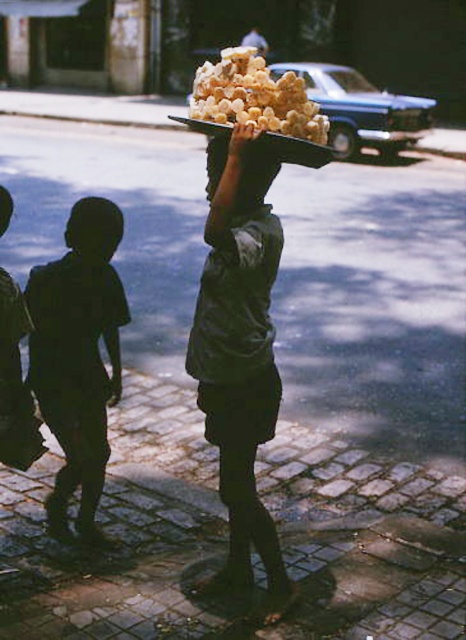
Which is above, dark green fabric shirt at center or silhouette skin child at left?

dark green fabric shirt at center

Does dark green fabric shirt at center have a smaller size compared to silhouette skin child at left?

No.

Between point (253, 208) and point (95, 300), which one is positioned behind?

The point (95, 300) is behind.

In order to click on dark green fabric shirt at center in this screenshot , I will do `click(239, 346)`.

Does silhouette skin child at left appear over black matte head at center?

No.

Is silhouette skin child at left positioned behind black matte head at center?

No, it is in front of black matte head at center.

Which is in front, point (94, 472) or point (88, 220)?

Point (88, 220)

This screenshot has width=466, height=640. I want to click on silhouette skin child at left, so click(77, 355).

Where is `golden crispy pastry at center`? golden crispy pastry at center is located at coordinates (254, 97).

Is golden crispy pastry at center to the left of smooth black head at upper left from the viewer's perspective?

Incorrect, golden crispy pastry at center is not on the left side of smooth black head at upper left.

The image size is (466, 640). What are the coordinates of `golden crispy pastry at center` in the screenshot? It's located at (254, 97).